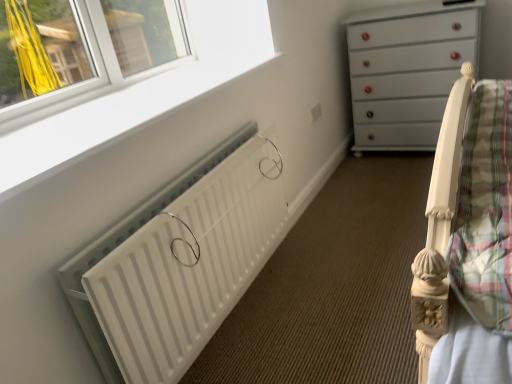
What do you see at coordinates (131, 92) in the screenshot?
I see `white plastic window frame at upper left` at bounding box center [131, 92].

What do you see at coordinates (407, 73) in the screenshot? Image resolution: width=512 pixels, height=384 pixels. I see `white glossy chest of drawers at upper right` at bounding box center [407, 73].

Find the location of `white glossy chest of drawers at upper right`. white glossy chest of drawers at upper right is located at coordinates (407, 73).

The width and height of the screenshot is (512, 384). I want to click on white plastic window frame at upper left, so click(131, 92).

From their relative heights in the image, would you say white plastic window frame at upper left is taller or shorter than white glossy chest of drawers at upper right?

Considering their sizes, white plastic window frame at upper left has less height than white glossy chest of drawers at upper right.

The width and height of the screenshot is (512, 384). I want to click on window frame that appears above the white glossy chest of drawers at upper right (from a real-world perspective), so click(x=131, y=92).

Who is bigger, white plastic window frame at upper left or white glossy chest of drawers at upper right?

With larger size is white glossy chest of drawers at upper right.

Consider the image. Is white matte radiator at lower left positioned beyond the bounds of white plastic window frame at upper left?

Yes, white matte radiator at lower left is located beyond the bounds of white plastic window frame at upper left.

Based on the photo, does white matte radiator at lower left come in front of white plastic window frame at upper left?

No.

Which object is thinner, white matte radiator at lower left or white plastic window frame at upper left?

white matte radiator at lower left is thinner.

Is white matte radiator at lower left directly adjacent to white plastic window frame at upper left?

No, white matte radiator at lower left is not in contact with white plastic window frame at upper left.

Looking at this image, how different are the orientations of white matte radiator at lower left and white glossy chest of drawers at upper right in degrees?

There is a 89.7-degree angle between the facing directions of white matte radiator at lower left and white glossy chest of drawers at upper right.

Would you say white matte radiator at lower left is outside white glossy chest of drawers at upper right?

white matte radiator at lower left lies outside white glossy chest of drawers at upper right's area.

In the scene shown: Is white matte radiator at lower left in front of or behind white glossy chest of drawers at upper right in the image?

Clearly, white matte radiator at lower left is in front of white glossy chest of drawers at upper right.

From a real-world perspective, between white glossy chest of drawers at upper right and white plastic window frame at upper left, who is vertically lower?

white glossy chest of drawers at upper right, from a real-world perspective.

How many degrees apart are the facing directions of white glossy chest of drawers at upper right and white plastic window frame at upper left?

89.7 degrees separate the facing orientations of white glossy chest of drawers at upper right and white plastic window frame at upper left.

Considering the points (430, 20) and (230, 74), which point is behind, point (430, 20) or point (230, 74)?

The point (430, 20) is more distant.

Considering the sizes of objects white glossy chest of drawers at upper right and white plastic window frame at upper left in the image provided, who is thinner, white glossy chest of drawers at upper right or white plastic window frame at upper left?

white glossy chest of drawers at upper right is thinner.

In the scene shown: Does white plastic window frame at upper left have a smaller size compared to white matte radiator at lower left?

Correct, white plastic window frame at upper left occupies less space than white matte radiator at lower left.

Considering the positions of objects white plastic window frame at upper left and white matte radiator at lower left in the image provided, who is in front, white plastic window frame at upper left or white matte radiator at lower left?

white plastic window frame at upper left is closer to the camera.

Can you confirm if white plastic window frame at upper left is wider than white matte radiator at lower left?

Indeed, white plastic window frame at upper left has a greater width compared to white matte radiator at lower left.

In terms of height, does white plastic window frame at upper left look taller or shorter compared to white matte radiator at lower left?

Clearly, white plastic window frame at upper left is shorter compared to white matte radiator at lower left.

Does white glossy chest of drawers at upper right have a greater height compared to white matte radiator at lower left?

Yes, white glossy chest of drawers at upper right is taller than white matte radiator at lower left.

Is white glossy chest of drawers at upper right not inside white matte radiator at lower left?

Yes, white glossy chest of drawers at upper right is located beyond the bounds of white matte radiator at lower left.

Does white glossy chest of drawers at upper right appear on the right side of white matte radiator at lower left?

Indeed, white glossy chest of drawers at upper right is positioned on the right side of white matte radiator at lower left.

Is white glossy chest of drawers at upper right bigger than white matte radiator at lower left?

Indeed, white glossy chest of drawers at upper right has a larger size compared to white matte radiator at lower left.

Find the location of a particular element. Image resolution: width=512 pixels, height=384 pixels. window frame lying in front of the white glossy chest of drawers at upper right is located at coordinates (x=131, y=92).

You are a GUI agent. You are given a task and a screenshot of the screen. Output one action in this format:
    pyautogui.click(x=<x>, y=<y>)
    Task: Click on the window frame that is above the white matte radiator at lower left (from the image's perspective)
    This screenshot has width=512, height=384.
    Given the screenshot: What is the action you would take?
    pyautogui.click(x=131, y=92)

From the image, which object appears to be farther from white plastic window frame at upper left, white glossy chest of drawers at upper right or white matte radiator at lower left?

white glossy chest of drawers at upper right is further to white plastic window frame at upper left.

Estimate the real-world distances between objects in this image. Which object is further from white matte radiator at lower left, white plastic window frame at upper left or white glossy chest of drawers at upper right?

Among the two, white glossy chest of drawers at upper right is located further to white matte radiator at lower left.

From the image, which object appears to be nearer to white glossy chest of drawers at upper right, white plastic window frame at upper left or white matte radiator at lower left?

white plastic window frame at upper left is closer to white glossy chest of drawers at upper right.

From the image, which object appears to be farther from white glossy chest of drawers at upper right, white matte radiator at lower left or white plastic window frame at upper left?

The object further to white glossy chest of drawers at upper right is white matte radiator at lower left.

Looking at this image, estimate the real-world distances between objects in this image. Which object is further from white matte radiator at lower left, white glossy chest of drawers at upper right or white plastic window frame at upper left?

Among the two, white glossy chest of drawers at upper right is located further to white matte radiator at lower left.

Looking at the image, which one is located further to white plastic window frame at upper left, white matte radiator at lower left or white glossy chest of drawers at upper right?

white glossy chest of drawers at upper right.

Where is `radiator between white plastic window frame at upper left and white glossy chest of drawers at upper right from left to right`? The image size is (512, 384). radiator between white plastic window frame at upper left and white glossy chest of drawers at upper right from left to right is located at coordinates (178, 264).